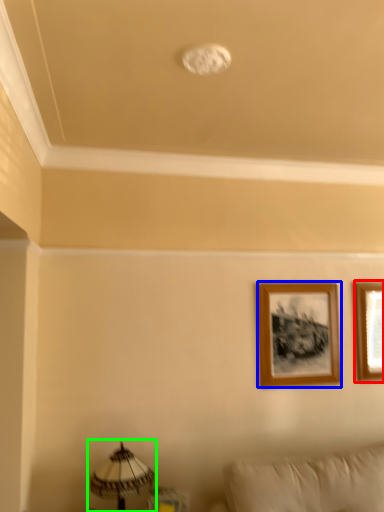
Question: Which is farther away from picture frame (highlighted by a red box)? picture frame (highlighted by a blue box) or table lamp (highlighted by a green box)?

Choices:
 (A) picture frame
 (B) table lamp

Answer: (B)